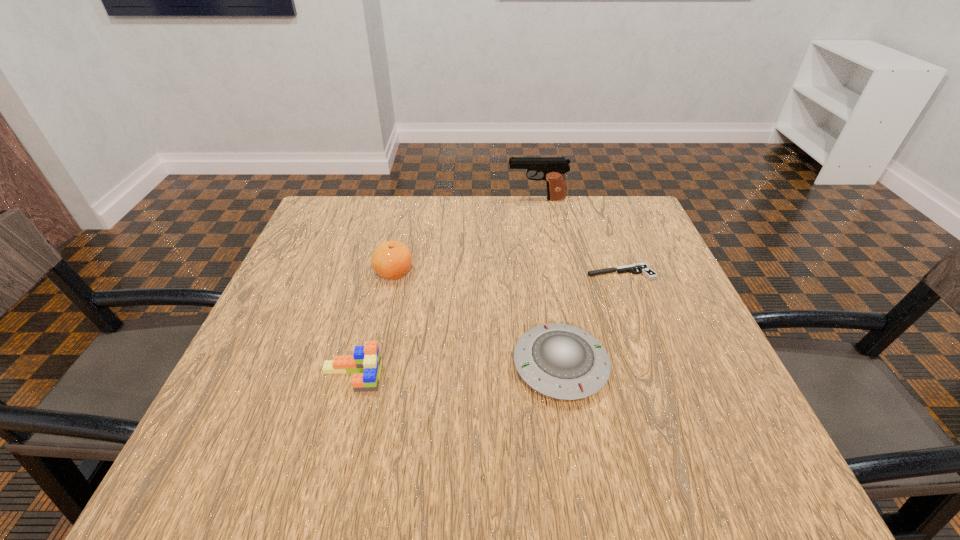
This screenshot has width=960, height=540. In order to click on vacant space that satisfies the following two spatial constraints: 1. on the front side of the clementine; 2. on the left side of the saucer in this screenshot , I will do `click(372, 366)`.